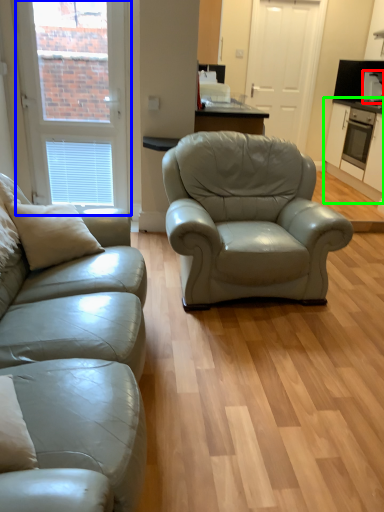
Question: Which object is positioned closest to appliance (highlighted by a red box)? Select from window (highlighted by a blue box) and cabinetry (highlighted by a green box).

Choices:
 (A) window
 (B) cabinetry

Answer: (B)